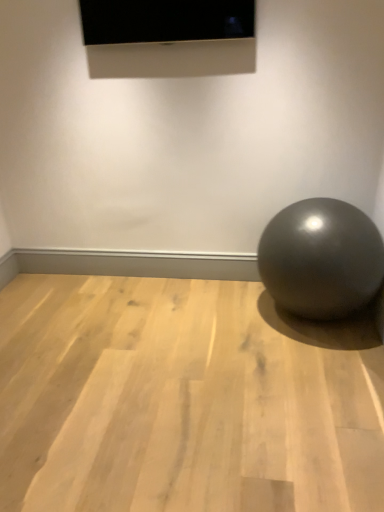
Question: From a real-world perspective, is glossy metallic ball at lower right located beneath light wood floor at center?

Choices:
 (A) yes
 (B) no

Answer: (B)

Question: Considering the relative positions of glossy metallic ball at lower right and light wood floor at center in the image provided, is glossy metallic ball at lower right to the left of light wood floor at center from the viewer's perspective?

Choices:
 (A) no
 (B) yes

Answer: (A)

Question: Is glossy metallic ball at lower right positioned before light wood floor at center?

Choices:
 (A) no
 (B) yes

Answer: (A)

Question: Is glossy metallic ball at lower right beside light wood floor at center?

Choices:
 (A) no
 (B) yes

Answer: (A)

Question: Can you confirm if glossy metallic ball at lower right is smaller than light wood floor at center?

Choices:
 (A) yes
 (B) no

Answer: (B)

Question: Does glossy metallic ball at lower right turn towards light wood floor at center?

Choices:
 (A) yes
 (B) no

Answer: (B)

Question: Considering the relative sizes of glossy metallic ball at lower right and matte black screen at upper center in the image provided, is glossy metallic ball at lower right thinner than matte black screen at upper center?

Choices:
 (A) no
 (B) yes

Answer: (A)

Question: From a real-world perspective, does glossy metallic ball at lower right stand above matte black screen at upper center?

Choices:
 (A) no
 (B) yes

Answer: (A)

Question: Is glossy metallic ball at lower right outside matte black screen at upper center?

Choices:
 (A) no
 (B) yes

Answer: (B)

Question: Is glossy metallic ball at lower right wider than matte black screen at upper center?

Choices:
 (A) yes
 (B) no

Answer: (A)

Question: Is glossy metallic ball at lower right oriented towards matte black screen at upper center?

Choices:
 (A) no
 (B) yes

Answer: (A)

Question: Is matte black screen at upper center at the back of glossy metallic ball at lower right?

Choices:
 (A) no
 (B) yes

Answer: (A)

Question: From a real-world perspective, does matte black screen at upper center stand above light wood floor at center?

Choices:
 (A) no
 (B) yes

Answer: (B)